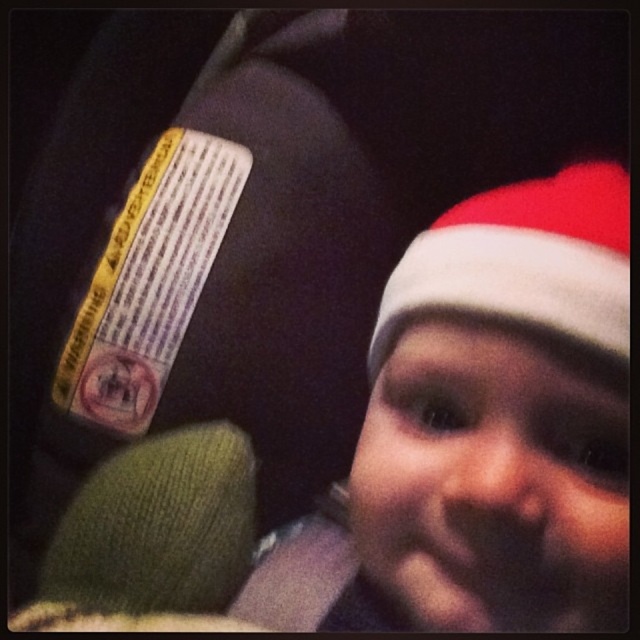
You are a fashion designer reviewing a photo of a child wearing two hats. The hats are the white knit hat at upper right and the red velvet santa hat at upper right. Which hat is positioned lower on the child?

The white knit hat at upper right is below the red velvet santa hat at upper right, so the white knit hat at upper right is positioned lower on the child.

You are holding a ruler and want to measure the distance from your eye to the point at coordinates point (524, 436) in the image. What is the actual distance in centimeters?

The distance of point (524, 436) from viewer is 28.78 centimeters.

From the picture: You are a fashion designer reviewing a photo of a child wearing two hats. The hats are the white knit hat at upper right and the red velvet santa hat at upper right. Which of these two hats is taller?

The white knit hat at upper right is taller than the red velvet santa hat at upper right according to the description.